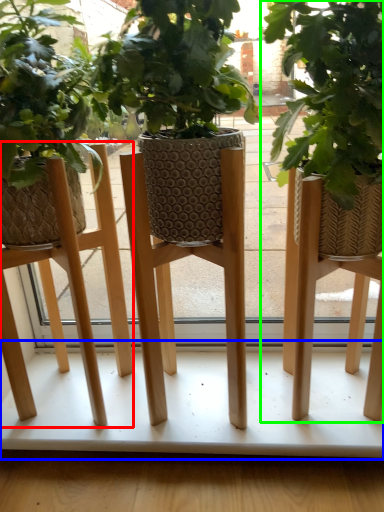
Question: Considering the real-world distances, which object is farthest from stool (highlighted by a red box)? table (highlighted by a blue box) or houseplant (highlighted by a green box)?

Choices:
 (A) table
 (B) houseplant

Answer: (B)